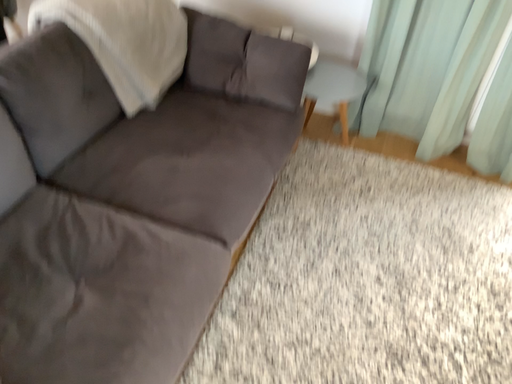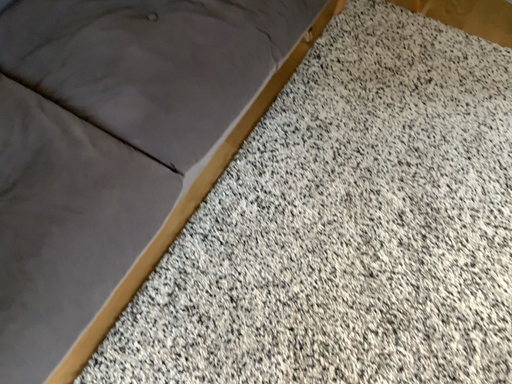
Question: How did the camera likely rotate when shooting the video?

Choices:
 (A) rotated left
 (B) rotated right

Answer: (A)